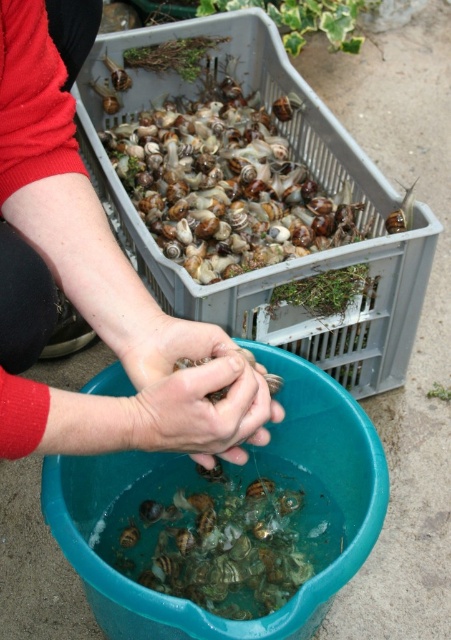
You are standing in the scene and want to move from the point at coordinates point (56, 241) to the point at coordinates point (266, 396). Which direction should you move to reach your destination?

To move from point (56, 241) to point (266, 396), you should move towards the direction where the y coordinate increases because point (266, 396) has a higher y value than point (56, 241). However, since point (56, 241) is in front of point (266, 396), you might need to move backward or adjust your position accordingly based on the spatial arrangement.

Looking at this image, you are a photographer trying to capture a closeup of the snails in the translucent plastic crate at upper center. Given that your camera can focus on objects within 1 meter, will you need to move closer to the crate to get a clear shot?

The translucent plastic crate at upper center is 1.25 meters away from camera, so you need to move closer to ensure the camera can focus within its 1 meter range.

You are a delivery person standing at the camera position. You need to place a package that is 26 inches long on the ground between you and the point at coordinates point (x=105, y=419). Will the package fit without overlapping the point?

The distance between the camera and point (x=105, y=419) is 26.95 inches. Since the package is 26 inches long, it will fit as it is shorter than the available space.